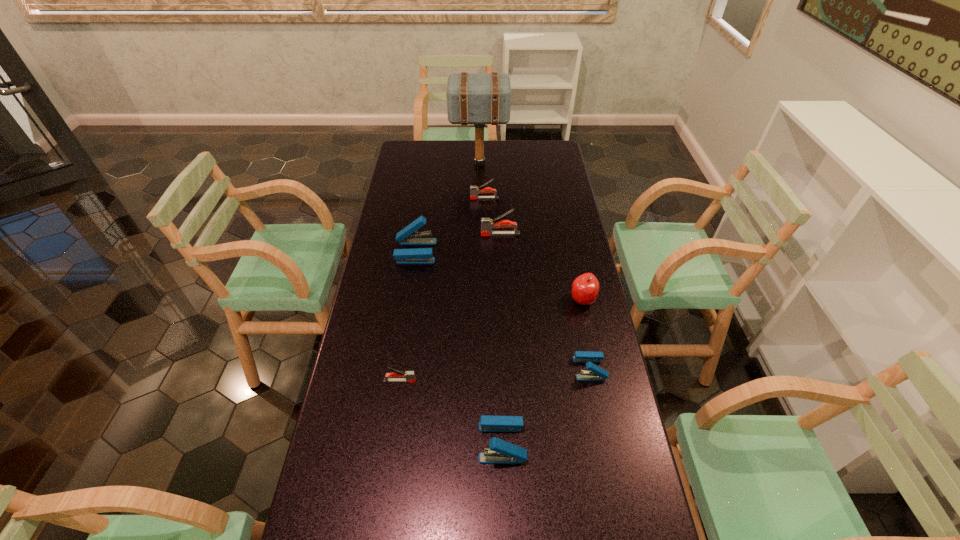
Locate an element on the screen. The height and width of the screenshot is (540, 960). stapler at the right edge is located at coordinates (596, 373).

You are a GUI agent. You are given a task and a screenshot of the screen. Output one action in this format:
    pyautogui.click(x=<x>, y=<y>)
    Task: Click on the vacant space at the far edge of the desktop
    The width and height of the screenshot is (960, 540).
    Given the screenshot: What is the action you would take?
    pyautogui.click(x=528, y=161)

This screenshot has height=540, width=960. In the image, there is a desktop. What are the coordinates of `vacant space at the left edge` in the screenshot? It's located at (373, 436).

You are a GUI agent. You are given a task and a screenshot of the screen. Output one action in this format:
    pyautogui.click(x=<x>, y=<y>)
    Task: Click on the vacant point at the right edge
    The height and width of the screenshot is (540, 960).
    Given the screenshot: What is the action you would take?
    pyautogui.click(x=574, y=222)

The height and width of the screenshot is (540, 960). In order to click on vacant space in between the third farthest stapler and the farthest stapler in this screenshot , I will do `click(450, 225)`.

You are a GUI agent. You are given a task and a screenshot of the screen. Output one action in this format:
    pyautogui.click(x=<x>, y=<y>)
    Task: Click on the unoccupied position between the smallest blue stapler and the farthest gray stapler
    The image size is (960, 540).
    Given the screenshot: What is the action you would take?
    click(x=537, y=284)

I want to click on empty space between the biggest gray stapler and the farthest blue stapler, so click(x=458, y=243).

Locate an element on the screen. vacant space that is in between the farthest object and the smallest gray stapler is located at coordinates (440, 273).

Locate an element on the screen. Image resolution: width=960 pixels, height=540 pixels. free point between the biggest blue stapler and the red apple is located at coordinates (499, 276).

This screenshot has height=540, width=960. Identify the location of unoccupied area between the leftmost blue stapler and the second biggest gray stapler. (450, 225).